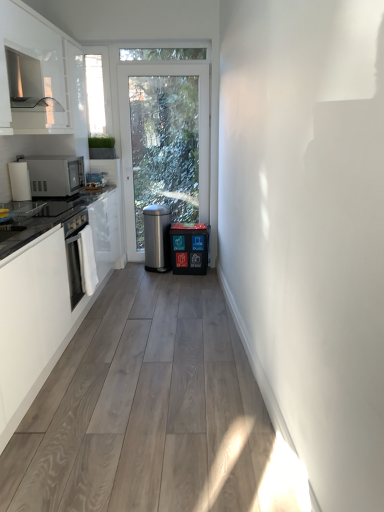
Where is `free space in front of polished stainless steel trash can at center`? free space in front of polished stainless steel trash can at center is located at coordinates (152, 273).